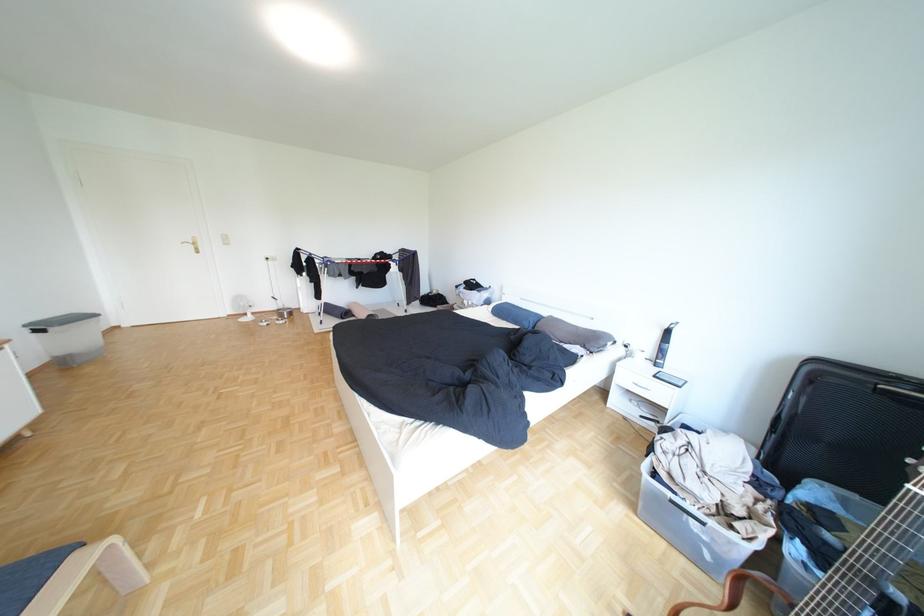
The location [282,309] corresponds to which object?

It refers to a silver bowl.